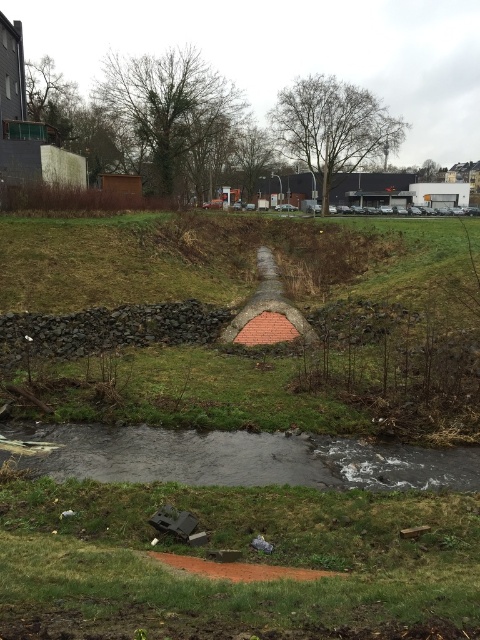
Who is shorter, green grass at lower center or gray smooth stream at lower center?

gray smooth stream at lower center

Is green grass at lower center further to the viewer compared to gray smooth stream at lower center?

No, it is in front of gray smooth stream at lower center.

Which is in front, point (142, 609) or point (241, 458)?

Positioned in front is point (142, 609).

This screenshot has width=480, height=640. I want to click on green grass at lower center, so click(x=242, y=557).

Does green grass at center have a smaller size compared to gray smooth stream at lower center?

No.

Where is `green grass at center`? The width and height of the screenshot is (480, 640). green grass at center is located at coordinates (230, 502).

Is green grass at center to the right of green grass at lower center from the viewer's perspective?

Incorrect, green grass at center is not on the right side of green grass at lower center.

Does point (251, 474) come in front of point (351, 625)?

That is False.

Which is in front, point (369, 509) or point (362, 602)?

Point (362, 602) is in front.

Locate an element on the screen. The height and width of the screenshot is (640, 480). green grass at center is located at coordinates (230, 502).